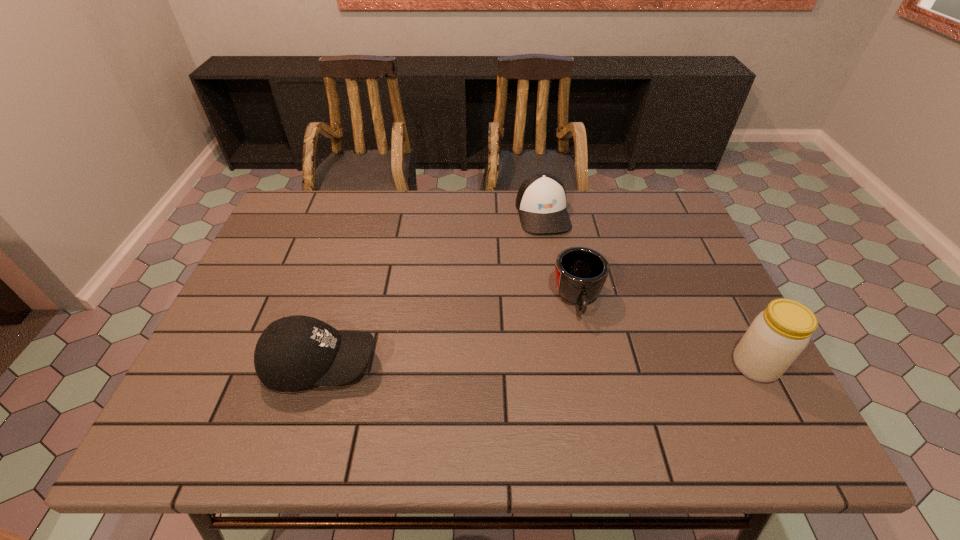
Image resolution: width=960 pixels, height=540 pixels. In order to click on blank region between the third nearest object and the baseball cap in this screenshot , I will do `click(449, 332)`.

You are a GUI agent. You are given a task and a screenshot of the screen. Output one action in this format:
    pyautogui.click(x=<x>, y=<y>)
    Task: Click on the unoccupied position between the rightmost object and the cap
    
    Given the screenshot: What is the action you would take?
    pyautogui.click(x=649, y=289)

What are the coordinates of `free space between the farthest object and the baseball cap` in the screenshot? It's located at (432, 288).

You are a GUI agent. You are given a task and a screenshot of the screen. Output one action in this format:
    pyautogui.click(x=<x>, y=<y>)
    Task: Click on the free space between the cap and the baseball cap
    
    Given the screenshot: What is the action you would take?
    coord(432,288)

At what (x,y) coordinates should I click in order to perform the action: click on empty space that is in between the jar and the cap. Please return your answer as a coordinate pair (x, y). The width and height of the screenshot is (960, 540). Looking at the image, I should click on (649, 289).

Find the location of a particular element. free area in between the baseball cap and the mug is located at coordinates (449, 332).

This screenshot has height=540, width=960. What are the coordinates of `object identified as the second closest to the rightmost object` in the screenshot? It's located at (541, 200).

Choose which object is the second nearest neighbor to the third nearest object. Please provide its 2D coordinates. Your answer should be formatted as a tuple, i.e. [(x, y)], where the tuple contains the x and y coordinates of a point satisfying the conditions above.

[(777, 336)]